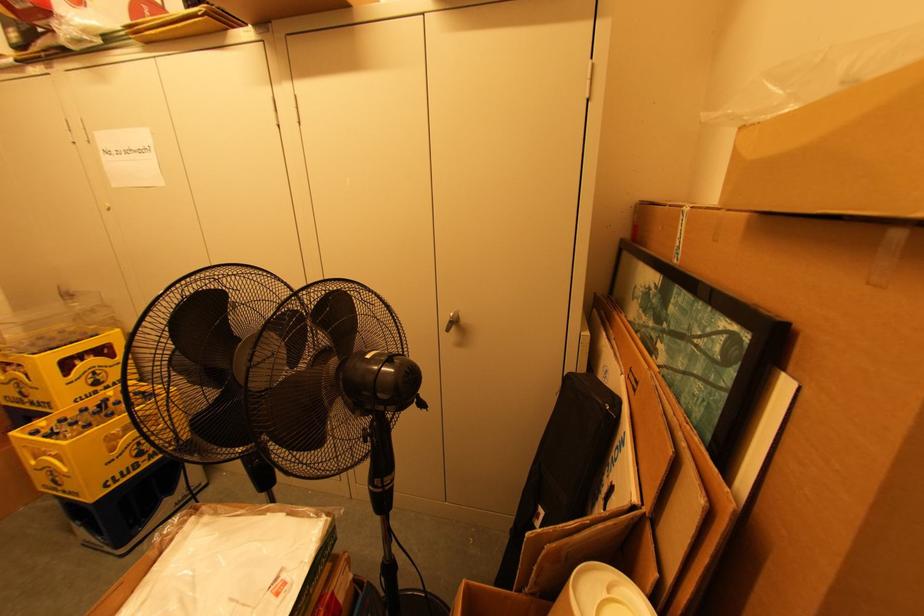
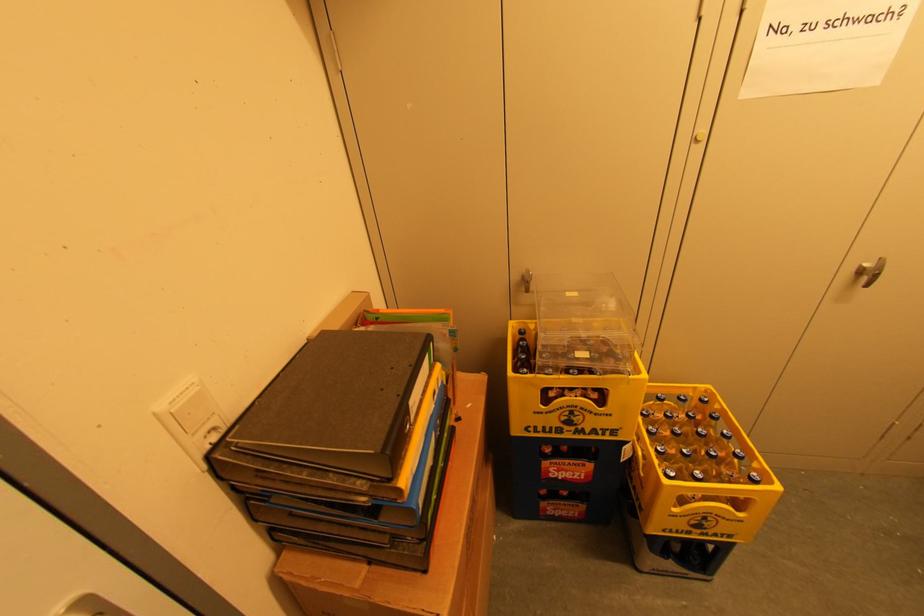
Locate, in the second image, the point that corresponds to pixel 117 185 in the first image.

(748, 92)